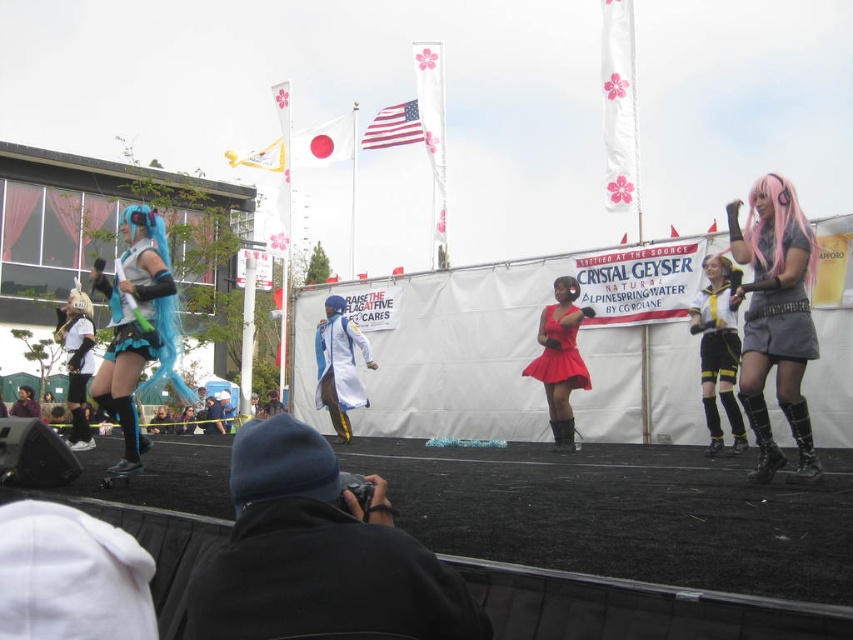
Describe the element at coordinates (137, 326) in the screenshot. I see `shiny blue wig at left` at that location.

Who is positioned more to the right, shiny blue wig at left or yellow and black striped shorts at center?

yellow and black striped shorts at center

Is point (142, 237) positioned before point (726, 346)?

Yes.

Where is `shiny blue wig at left`? This screenshot has width=853, height=640. shiny blue wig at left is located at coordinates (137, 326).

Who is shorter, yellow/black striped socks at center or matte red dress at center?

matte red dress at center is shorter.

Is point (726, 321) positioned before point (583, 364)?

Yes, it is.

Where is `yellow/black striped socks at center`? The width and height of the screenshot is (853, 640). yellow/black striped socks at center is located at coordinates (718, 349).

Locate an element on the screen. The height and width of the screenshot is (640, 853). yellow/black striped socks at center is located at coordinates (718, 349).

Is point (740, 422) positioned in front of point (550, 374)?

Yes, point (740, 422) is in front of point (550, 374).

Find the location of `yellow/black striped socks at center`. yellow/black striped socks at center is located at coordinates (718, 349).